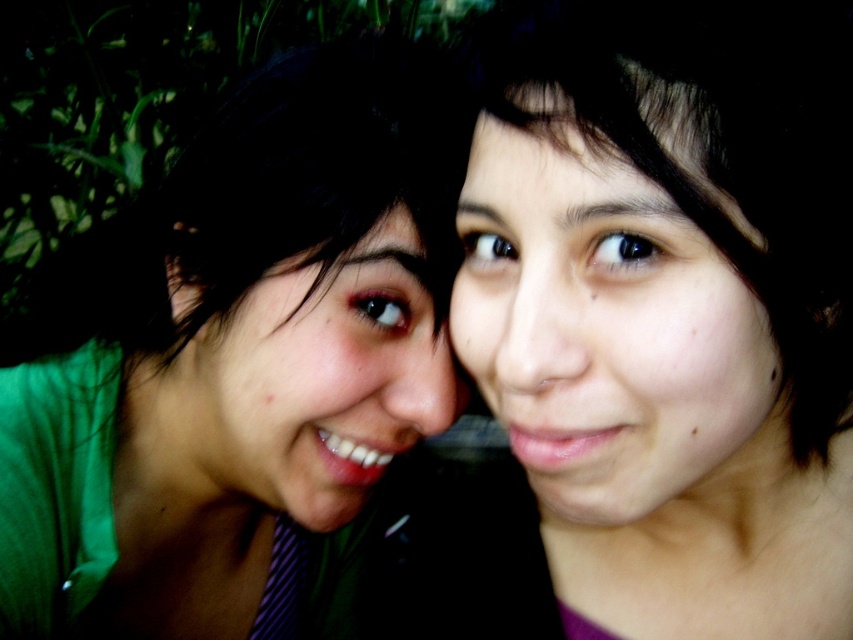
Question: Does smooth skin face at center appear over matte green shirt at center?

Choices:
 (A) no
 (B) yes

Answer: (B)

Question: Observing the image, what is the correct spatial positioning of smooth skin face at center in reference to matte green shirt at center?

Choices:
 (A) left
 (B) right

Answer: (B)

Question: Estimate the real-world distances between objects in this image. Which object is closer to the green matte shirt at left?

Choices:
 (A) matte green shirt at center
 (B) smooth skin face at center

Answer: (A)

Question: Which point appears closest to the camera in this image?

Choices:
 (A) (515, 301)
 (B) (344, 260)
 (C) (213, 476)

Answer: (A)

Question: Which point is farther to the camera?

Choices:
 (A) green matte shirt at left
 (B) matte green shirt at center
 (C) smooth skin face at center

Answer: (B)

Question: Is green matte shirt at left bigger than smooth skin face at center?

Choices:
 (A) no
 (B) yes

Answer: (B)